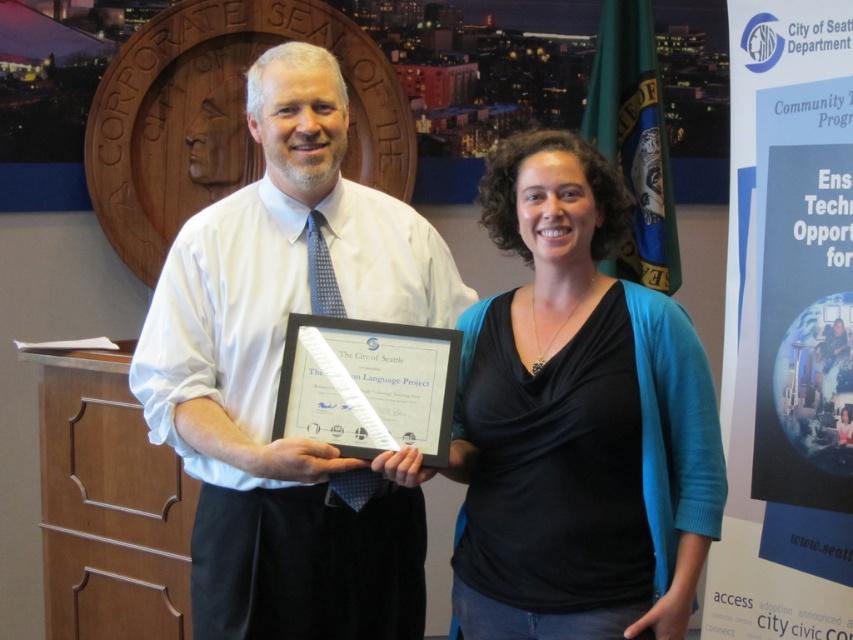
Can you confirm if white shirt at center is wider than black matte card at center?

Correct, the width of white shirt at center exceeds that of black matte card at center.

Between point (335, 188) and point (625, 484), which one is positioned behind?

The point (335, 188) is more distant.

You are a GUI agent. You are given a task and a screenshot of the screen. Output one action in this format:
    pyautogui.click(x=<x>, y=<y>)
    Task: Click on the white shirt at center
    
    Given the screenshot: What is the action you would take?
    [279, 374]

Locate an element on the screen. The height and width of the screenshot is (640, 853). black matte card at center is located at coordinates (579, 406).

What are the coordinates of `black matte card at center` in the screenshot? It's located at (579, 406).

Is black matte card at center further to camera compared to beech wood drawer at lower left?

That is False.

Can you confirm if black matte card at center is positioned above beech wood drawer at lower left?

Yes, black matte card at center is above beech wood drawer at lower left.

Who is more distant from viewer, (x=701, y=429) or (x=128, y=604)?

The point (x=128, y=604) is more distant.

The width and height of the screenshot is (853, 640). I want to click on black matte card at center, so click(x=579, y=406).